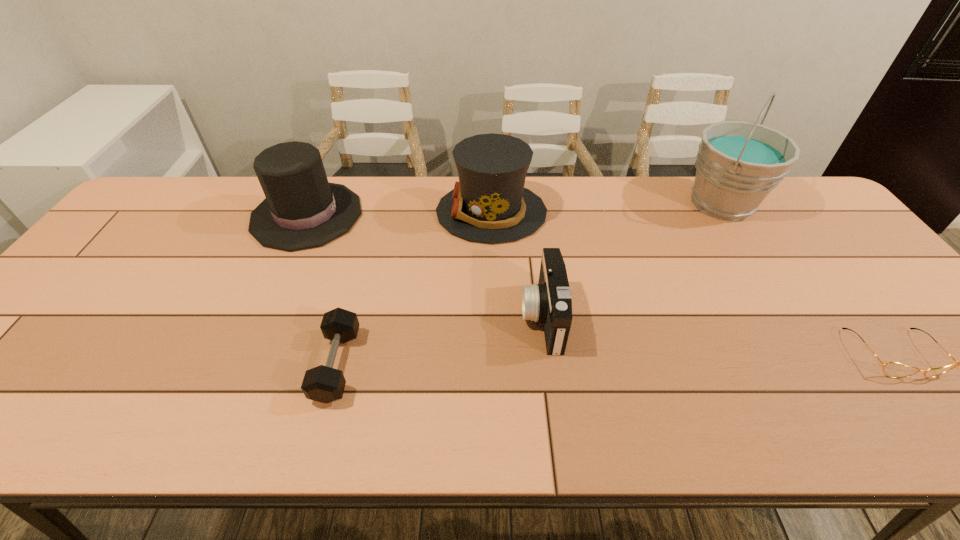
This screenshot has width=960, height=540. Identify the location of free spot at the far edge of the desktop. (394, 219).

Locate an element on the screen. The height and width of the screenshot is (540, 960). vacant space at the near edge of the desktop is located at coordinates (675, 427).

Locate an element on the screen. The width and height of the screenshot is (960, 540). vacant space at the left edge is located at coordinates (107, 287).

Identify the location of free space at the right edge of the desktop. (828, 278).

In the image, there is a desktop. Where is `blank space at the far left corner`? This screenshot has height=540, width=960. blank space at the far left corner is located at coordinates pos(194,200).

In the image, there is a desktop. Where is `free space at the far right corner`? The image size is (960, 540). free space at the far right corner is located at coordinates (806, 202).

Locate an element on the screen. The image size is (960, 540). empty location between the right dress hat and the fourth tallest object is located at coordinates (516, 265).

You are a GUI agent. You are given a task and a screenshot of the screen. Output one action in this format:
    pyautogui.click(x=<x>, y=<y>)
    Task: Click on the vacant region between the left dress hat and the right dress hat
    
    Given the screenshot: What is the action you would take?
    pyautogui.click(x=399, y=214)

The height and width of the screenshot is (540, 960). I want to click on vacant space that is in between the right dress hat and the leftmost object, so click(x=399, y=214).

Identify the location of empty space that is in between the right dress hat and the dumbbell. The height and width of the screenshot is (540, 960). (414, 288).